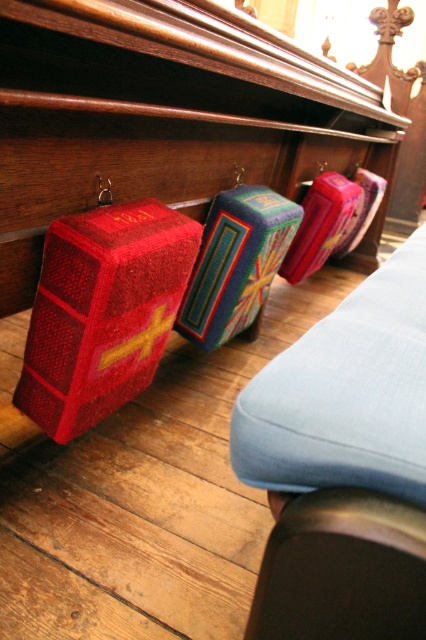
You are a visitor who wants to place a 16 inch long decorative item between the matte blue cushion at center and the velvet red book at left. Can you fit it there?

The distance between the matte blue cushion at center and the velvet red book at left is 17.92 inches. Since the decorative item is 16 inches long, it can fit in the space between them.

You are sitting on a pew in a church and need to reach for the velvet red book at left and the matte blue cushion at center. Which object is closer to your left side?

The velvet red book at left is closer to your left side because it is positioned to the left of the matte blue cushion at center.